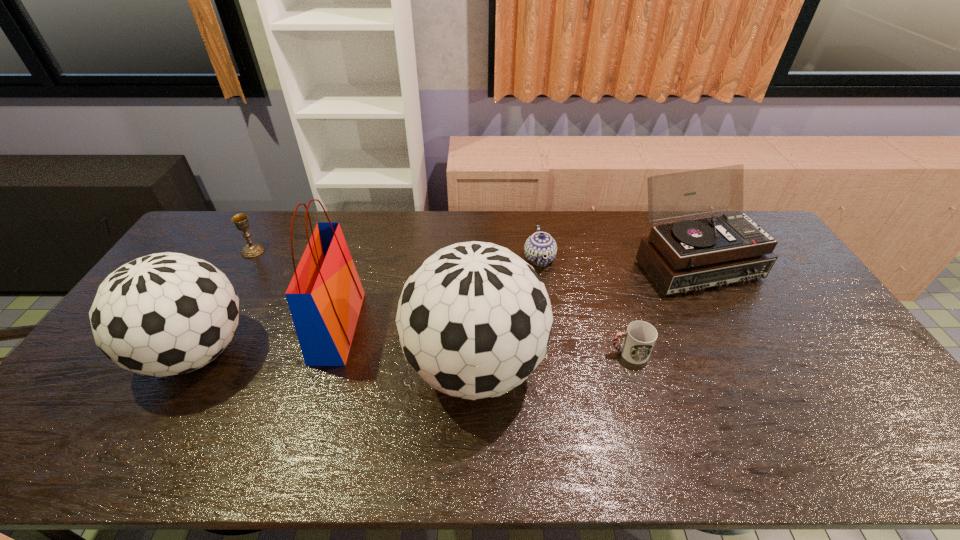
Find the location of a particular element. chinaware positioned at the far edge is located at coordinates pos(539,245).

What are the coordinates of `chalice situated at the far edge` in the screenshot? It's located at (241, 221).

This screenshot has width=960, height=540. Identify the location of object that is at the left edge. (164, 314).

In order to click on object positioned at the right edge in this screenshot , I will do `click(689, 255)`.

At what (x,y) coordinates should I click in order to perform the action: click on object that is at the near left corner. Please return your answer as a coordinate pair (x, y). Looking at the image, I should click on (164, 314).

Where is `object present at the far right corner`? The image size is (960, 540). object present at the far right corner is located at coordinates (689, 255).

Find the location of a particular element. The image size is (960, 540). blank area at the far edge is located at coordinates (555, 241).

In the image, there is a desktop. Identify the location of vacant space at the near edge. The height and width of the screenshot is (540, 960). (736, 401).

The image size is (960, 540). I want to click on vacant space at the right edge of the desktop, so click(x=878, y=386).

Image resolution: width=960 pixels, height=540 pixels. In order to click on vacant region at the far left corner of the desktop in this screenshot , I will do `click(215, 215)`.